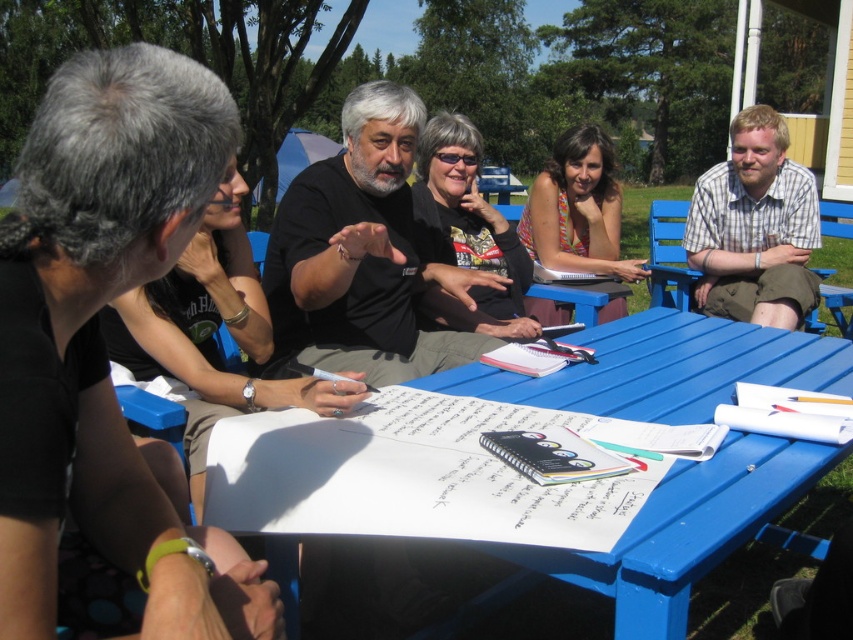
You are standing in a park and see the blue plastic table at center. If you want to place a 40 inch long board on it, will it fit? Please explain your reasoning.

The blue plastic table at center is 36.21 inches from viewer. Since the board is 40 inches long, it is longer than the table, so it won

You are standing at the origin point of the coordinate system. You want to move to the blue plastic table at center. Which direction should you move? Please provide the coordinates of the table to help determine the direction.

The blue plastic table at center is located at coordinates point (x=547, y=486). To reach it from the origin, you should move towards the positive x and y directions since both coordinates are greater than zero.

You are a photographer standing behind the picnic table and want to capture a photo of the black matte shirt at center and the blue wood park bench at right. Which object is taller in the frame?

The black matte shirt at center is taller than the blue wood park bench at right, so it will appear taller in the photo.